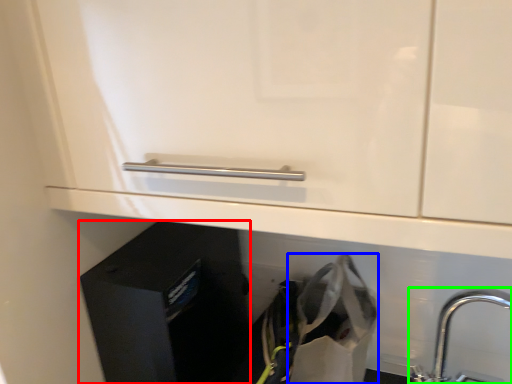
Question: Which is nearer to the file cabinet (highlighted by a red box)? shopping bag (highlighted by a blue box) or tap (highlighted by a green box).

Choices:
 (A) shopping bag
 (B) tap

Answer: (A)